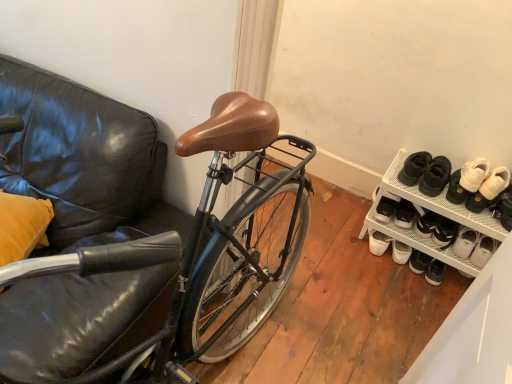
Question: Is white suede sneakers at upper right, which is the second footwear in right-to-left order, to the left of white leather shoe at lower right from the viewer's perspective?

Choices:
 (A) no
 (B) yes

Answer: (B)

Question: From a real-world perspective, is white suede sneakers at upper right, the 1th footwear when ordered from left to right, under white leather shoe at lower right?

Choices:
 (A) yes
 (B) no

Answer: (A)

Question: Can you confirm if white suede sneakers at upper right, which is the second footwear in right-to-left order, is positioned to the right of white leather shoe at lower right?

Choices:
 (A) no
 (B) yes

Answer: (A)

Question: Is white suede sneakers at upper right, which is the second footwear in right-to-left order, not inside white leather shoe at lower right?

Choices:
 (A) no
 (B) yes

Answer: (B)

Question: Considering the relative sizes of white suede sneakers at upper right, the 1th footwear when ordered from left to right, and white leather shoe at lower right in the image provided, is white suede sneakers at upper right, the 1th footwear when ordered from left to right, smaller than white leather shoe at lower right?

Choices:
 (A) no
 (B) yes

Answer: (A)

Question: Considering the relative sizes of white suede sneakers at upper right, the 1th footwear when ordered from left to right, and white leather shoe at lower right in the image provided, is white suede sneakers at upper right, the 1th footwear when ordered from left to right, thinner than white leather shoe at lower right?

Choices:
 (A) yes
 (B) no

Answer: (B)

Question: Is white mesh shoe rack at lower right directly adjacent to white suede sneakers at right, marked as the first footwear in a right-to-left arrangement?

Choices:
 (A) yes
 (B) no

Answer: (B)

Question: Is white mesh shoe rack at lower right at the left side of white suede sneakers at right, marked as the 2th footwear in a left-to-right arrangement?

Choices:
 (A) no
 (B) yes

Answer: (B)

Question: Can you confirm if white mesh shoe rack at lower right is bigger than white suede sneakers at right, marked as the 2th footwear in a left-to-right arrangement?

Choices:
 (A) no
 (B) yes

Answer: (B)

Question: Is the position of white mesh shoe rack at lower right more distant than that of white suede sneakers at right, marked as the 2th footwear in a left-to-right arrangement?

Choices:
 (A) no
 (B) yes

Answer: (A)

Question: Can you confirm if white mesh shoe rack at lower right is thinner than white suede sneakers at right, marked as the 2th footwear in a left-to-right arrangement?

Choices:
 (A) no
 (B) yes

Answer: (A)

Question: From the image's perspective, is white mesh shoe rack at lower right on top of white suede sneakers at right, marked as the first footwear in a right-to-left arrangement?

Choices:
 (A) no
 (B) yes

Answer: (A)

Question: Does white mesh shoe rack at lower right come in front of white leather shoe at lower right?

Choices:
 (A) no
 (B) yes

Answer: (A)